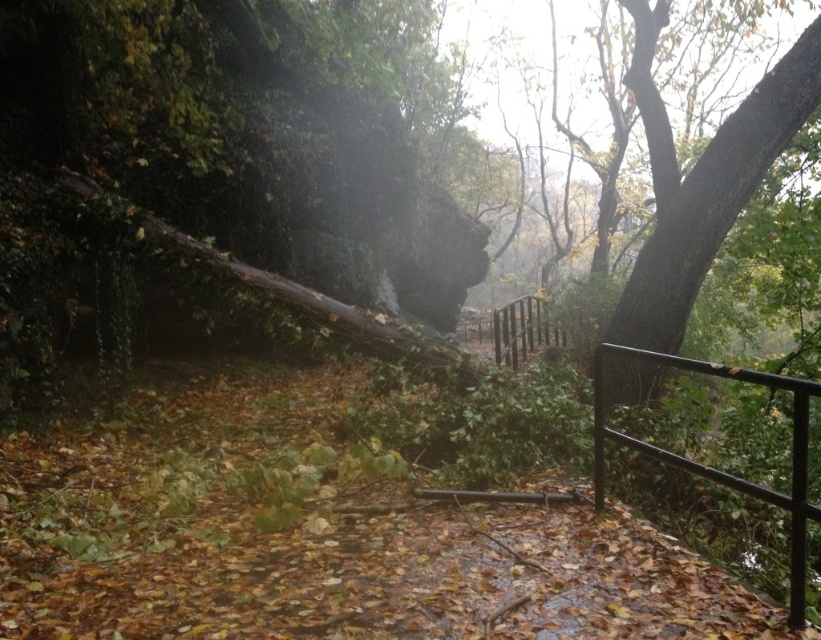
You are standing at the center of the forest path and want to find the brown rough bark tree at upper right. According to the scene, where should you look relative to your position?

The brown rough bark tree at upper right is located at the upper right area of the scene, so you should look towards the upper right direction from your current position at the center of the forest path.

You are standing at the center of the forest path and see a point at coordinates (702, 180). Which object in the scene is this point located on?

The point at coordinates (702, 180) is located on the brown rough bark tree at upper right.

You are standing at the point marked as point (631, 3) in the forest scene. The path ahead is obstructed by a large tree trunk. If you want to walk towards the metal railing on the right side of the image, which direction should you move relative to the tree trunk?

Since the metal railing is on the right side of the image and the tree trunk is obstructing the path, you should move around the tree trunk towards the right to reach the metal railing.